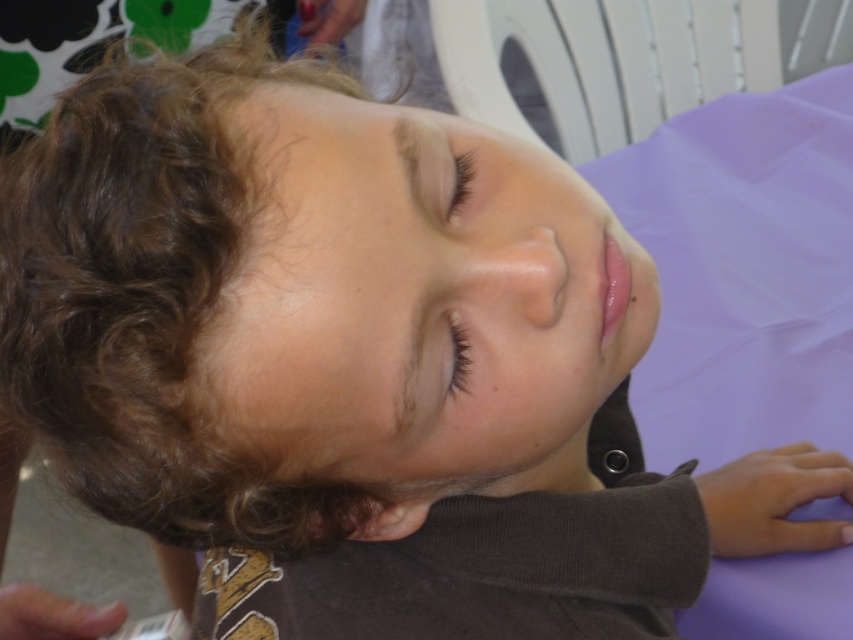
Can you confirm if curly brown hair at upper left is wider than black eyelashes at upper center?

Yes.

Is curly brown hair at upper left above black eyelashes at upper center?

Incorrect, curly brown hair at upper left is not positioned above black eyelashes at upper center.

Who is more distant from viewer, (50, 429) or (450, 202)?

The point (450, 202) is behind.

Image resolution: width=853 pixels, height=640 pixels. Find the location of `curly brown hair at upper left`. curly brown hair at upper left is located at coordinates (148, 300).

Can you confirm if brown matte eye at center is bigger than black eyelashes at upper center?

No, brown matte eye at center is not bigger than black eyelashes at upper center.

Which is behind, point (459, 385) or point (456, 170)?

Positioned behind is point (456, 170).

Between point (457, 323) and point (469, 179), which one is positioned behind?

Positioned behind is point (469, 179).

The height and width of the screenshot is (640, 853). I want to click on brown matte eye at center, so click(x=457, y=353).

Does curly brown hair at upper left appear on the left side of brown matte eye at center?

Yes, curly brown hair at upper left is to the left of brown matte eye at center.

Does point (38, 308) lie in front of point (456, 369)?

That is True.

Between point (120, 198) and point (460, 337), which one is positioned behind?

Point (460, 337)

You are a GUI agent. You are given a task and a screenshot of the screen. Output one action in this format:
    pyautogui.click(x=<x>, y=<y>)
    Task: Click on the curly brown hair at upper left
    This screenshot has width=853, height=640.
    Given the screenshot: What is the action you would take?
    pyautogui.click(x=148, y=300)